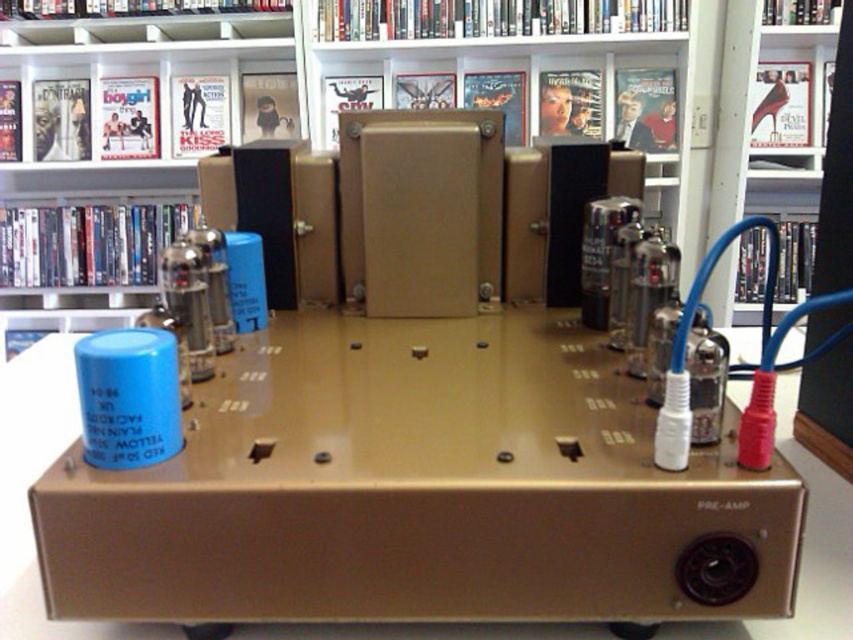
The height and width of the screenshot is (640, 853). What do you see at coordinates (328, 132) in the screenshot?
I see `metallic gold speaker at center` at bounding box center [328, 132].

Can you confirm if metallic gold speaker at center is wider than gold metallic speaker at upper center?

Yes, metallic gold speaker at center is wider than gold metallic speaker at upper center.

You are a GUI agent. You are given a task and a screenshot of the screen. Output one action in this format:
    pyautogui.click(x=<x>, y=<y>)
    Task: Click on the metallic gold speaker at center
    This screenshot has height=640, width=853.
    Given the screenshot: What is the action you would take?
    pyautogui.click(x=328, y=132)

Locate an element on the screen. The height and width of the screenshot is (640, 853). metallic gold speaker at center is located at coordinates (328, 132).

Locate an element on the screen. The image size is (853, 640). blue plastic capacitor at lower left is located at coordinates (122, 147).

Who is positioned more to the right, blue plastic capacitor at lower left or gold metallic table at center?

gold metallic table at center

Can you confirm if blue plastic capacitor at lower left is thinner than gold metallic table at center?

Yes.

Image resolution: width=853 pixels, height=640 pixels. In order to click on blue plastic capacitor at lower left in this screenshot , I will do `click(122, 147)`.

At what (x,y) coordinates should I click in order to perform the action: click on blue plastic capacitor at lower left. Please return your answer as a coordinate pair (x, y). This screenshot has width=853, height=640. Looking at the image, I should click on tap(122, 147).